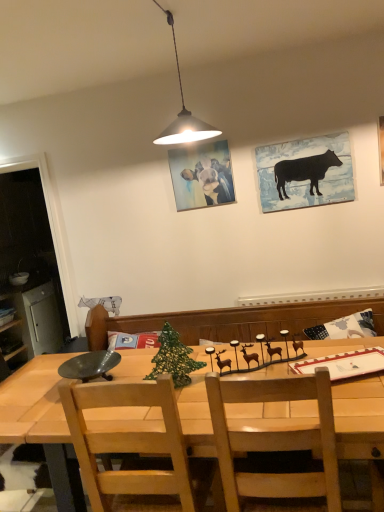
Find the location of a particular element. The width and height of the screenshot is (384, 512). free space in front of green mesh christmas tree at center is located at coordinates (178, 407).